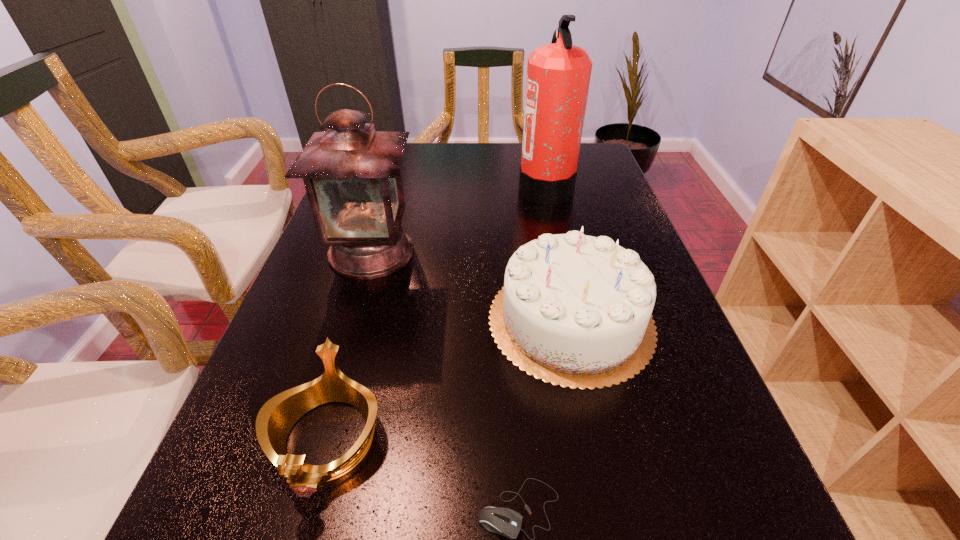
This screenshot has height=540, width=960. I want to click on empty location between the farthest object and the tiara, so click(436, 314).

Locate an element on the screen. The height and width of the screenshot is (540, 960). object that is the third closest one to the farthest object is located at coordinates 278,415.

The width and height of the screenshot is (960, 540). In order to click on object that can be found as the second closest to the second shortest object in this screenshot , I will do `click(575, 310)`.

You are a GUI agent. You are given a task and a screenshot of the screen. Output one action in this format:
    pyautogui.click(x=<x>, y=<y>)
    Task: Click on the vacant space that satisfies the following two spatial constraints: 1. on the front side of the farthest object; 2. on the front side of the oil lamp
    
    Given the screenshot: What is the action you would take?
    pyautogui.click(x=560, y=252)

Identify the location of vacant space that satisfies the following two spatial constraints: 1. on the front side of the tallest object; 2. at the front emblem of the second shortest object. (601, 440).

I want to click on vacant space that satisfies the following two spatial constraints: 1. on the front side of the oil lamp; 2. on the left side of the third tallest object, so click(350, 320).